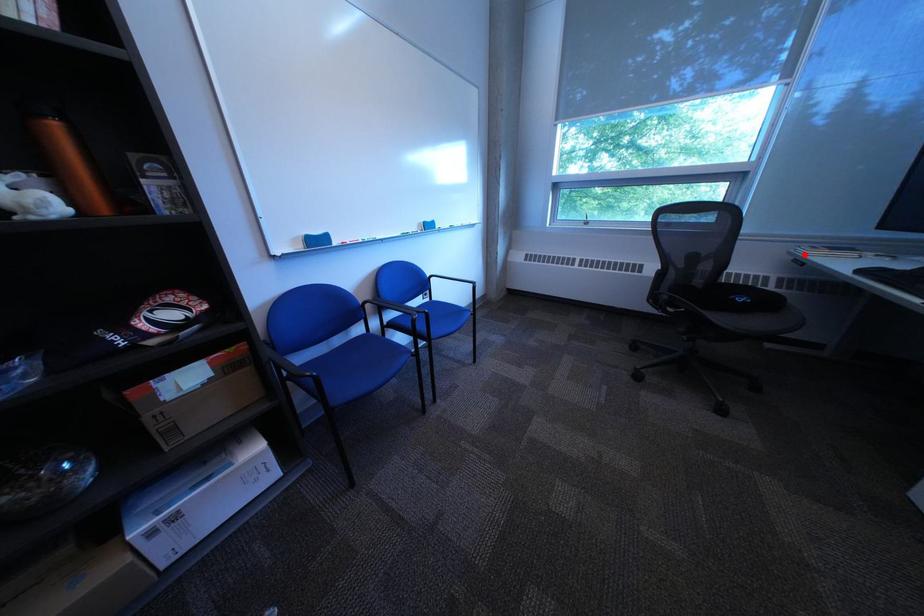
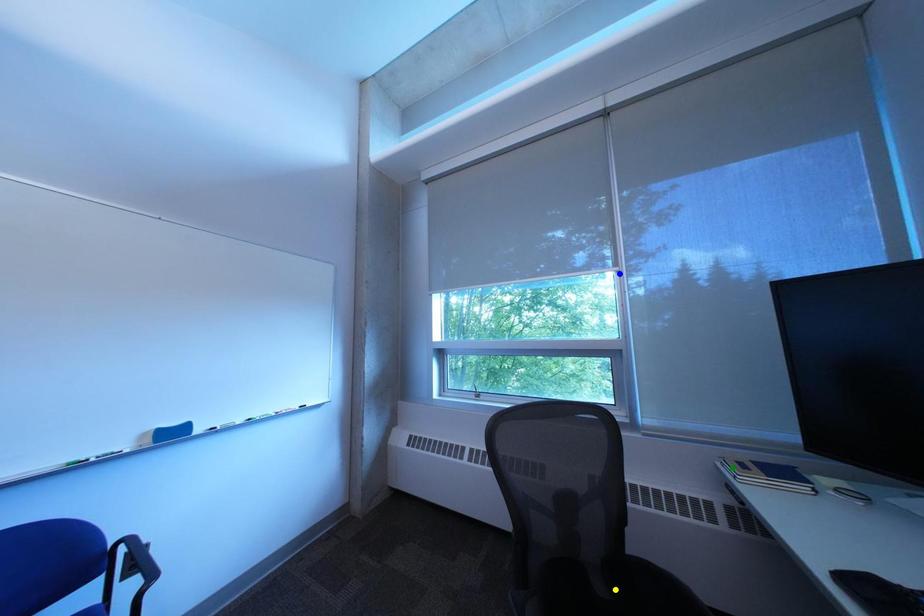
Question: I am providing you with two images of the same scene from different viewpoints. A red point is marked on the first image. You are given multiple points on the second image. Which spot in image 2 lines up with the point in image 1?

Choices:
 (A) green point
 (B) blue point
 (C) yellow point

Answer: (A)